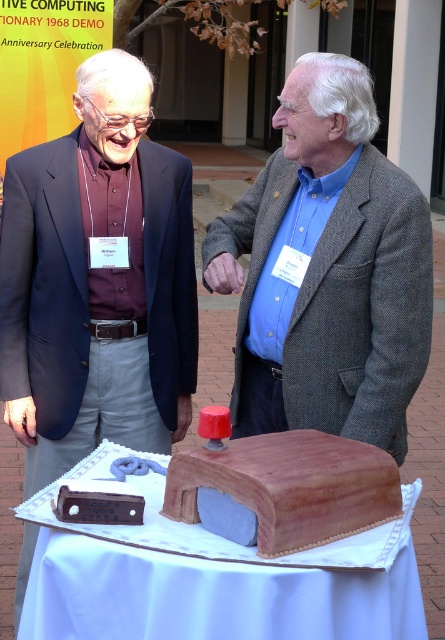
Does point (182, 321) come behind point (162, 624)?

Yes, point (182, 321) is behind point (162, 624).

The height and width of the screenshot is (640, 445). Find the location of `matte black suit at center`. matte black suit at center is located at coordinates (97, 282).

Is smooth brown cake at center further to the viewer compared to brown leather book at center?

No, smooth brown cake at center is closer to the viewer.

Who is more forward, [347,556] or [381,486]?

Point [347,556] is more forward.

Identify the location of smooth brown cake at center. The image size is (445, 640). (210, 577).

Consider the image. How much distance is there between blue woolen jacket at center and smooth brown cake at center?

33.63 inches

Between point (407, 276) and point (274, 563), which one is positioned in front?

Positioned in front is point (274, 563).

From the picture: Who is more forward, (246, 317) or (263, 595)?

Point (263, 595) is in front.

The height and width of the screenshot is (640, 445). Identify the location of blue woolen jacket at center. (327, 269).